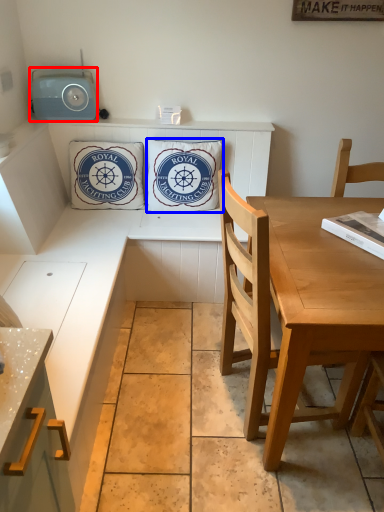
Question: Which point is further to the camera, radio (highlighted by a red box) or pillow (highlighted by a blue box)?

Choices:
 (A) radio
 (B) pillow

Answer: (B)